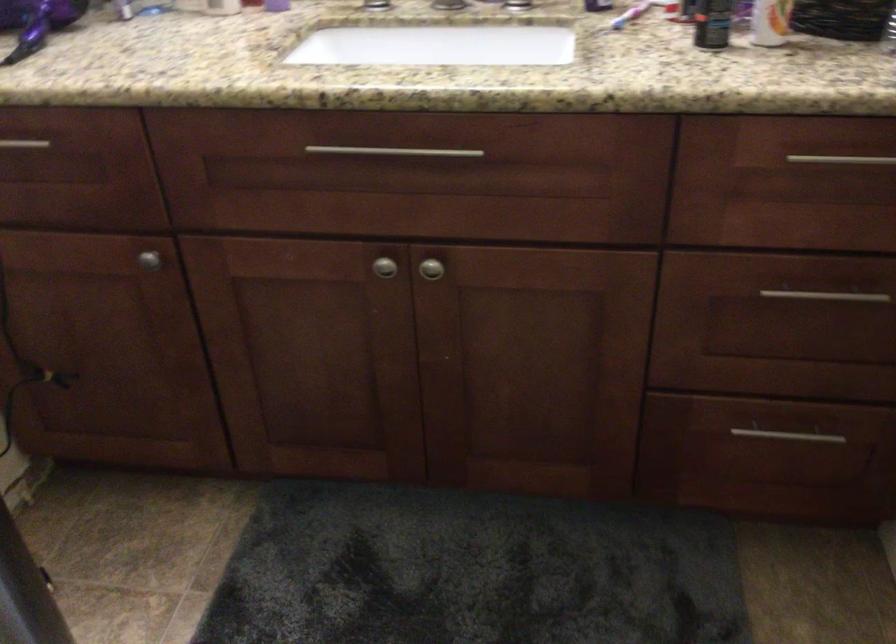
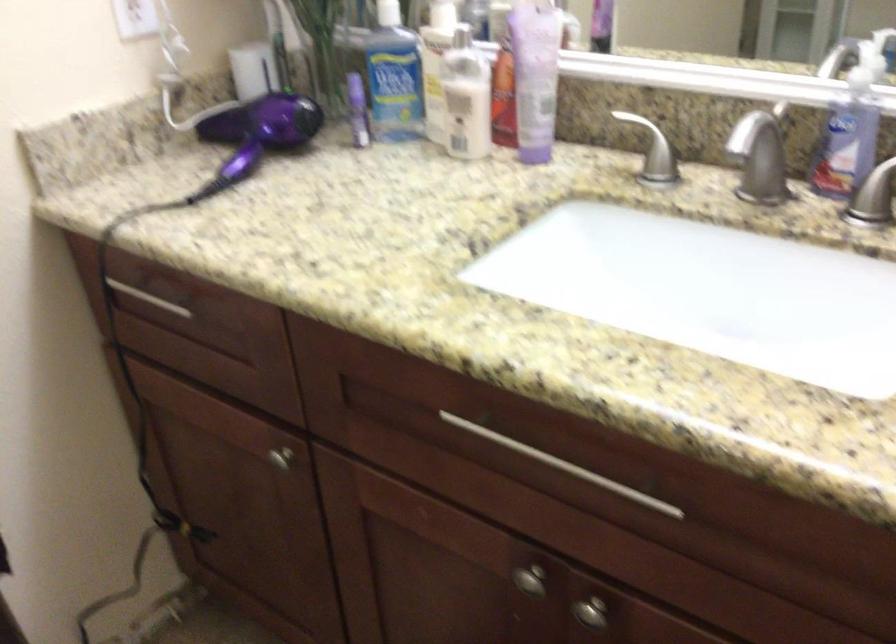
Locate, in the second image, the point that corresponds to pixel 436 269 in the first image.

(590, 612)